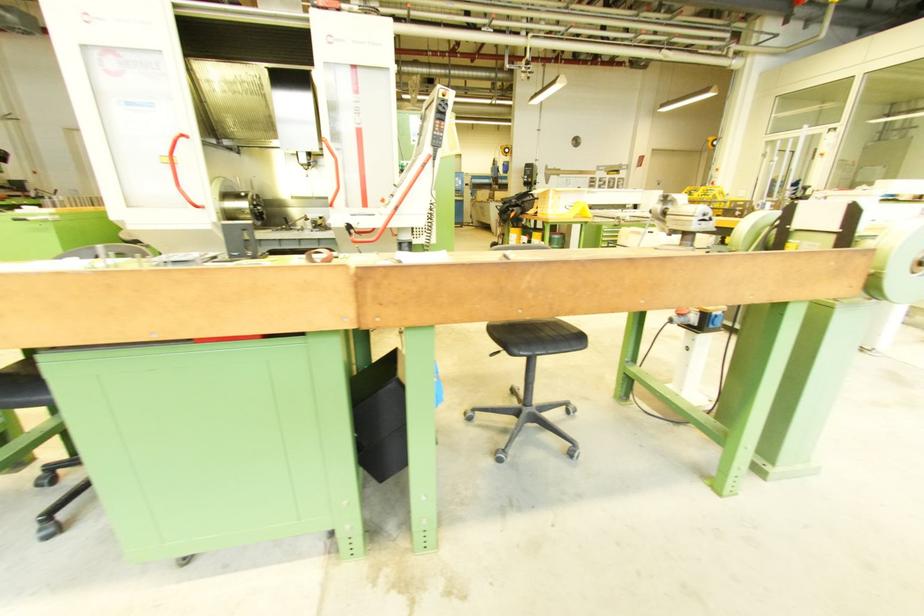
The width and height of the screenshot is (924, 616). I want to click on red push button, so click(319, 254).